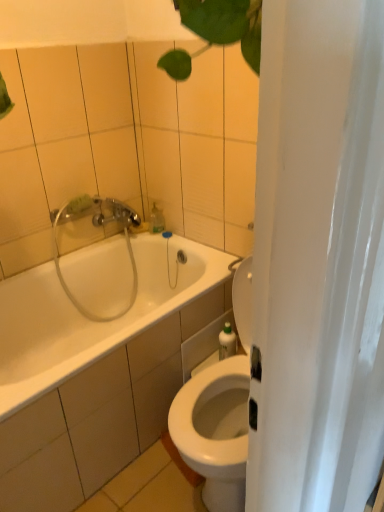
This screenshot has width=384, height=512. In order to click on blank space to the left of translucent plastic soap dispenser at upper center in this screenshot , I will do `click(127, 239)`.